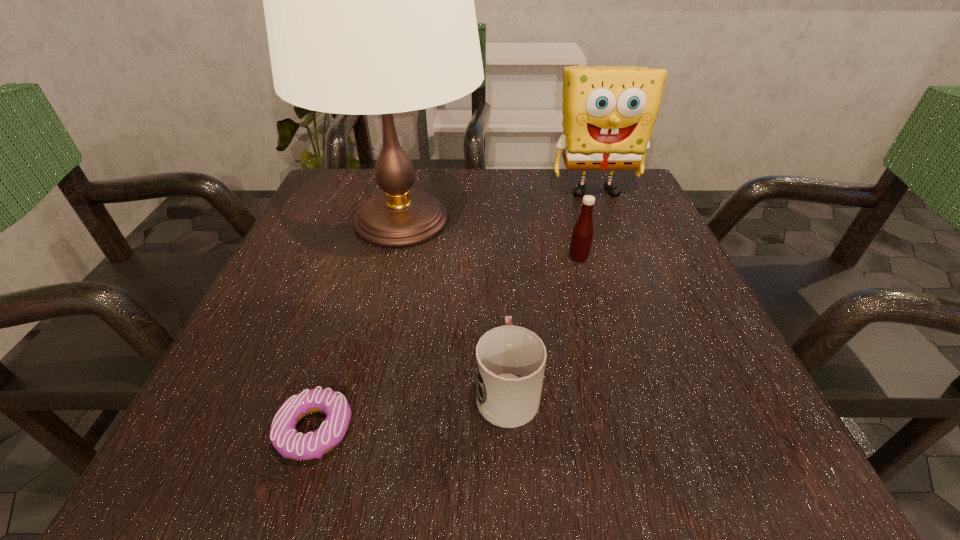
I want to click on object that is at the near left corner, so click(285, 438).

This screenshot has height=540, width=960. In order to click on object that is at the far right corner in this screenshot , I will do `click(609, 112)`.

This screenshot has width=960, height=540. In order to click on free location at the far edge of the desktop in this screenshot , I will do `click(517, 215)`.

You are a GUI agent. You are given a task and a screenshot of the screen. Output one action in this format:
    pyautogui.click(x=<x>, y=<y>)
    Task: Click on the vacant space at the near edge of the desktop
    The height and width of the screenshot is (540, 960).
    Given the screenshot: What is the action you would take?
    pyautogui.click(x=445, y=446)

At what (x,y) coordinates should I click in order to perform the action: click on vacant space at the left edge. Please return your answer as a coordinate pair (x, y). Looking at the image, I should click on (322, 338).

The height and width of the screenshot is (540, 960). In the image, there is a desktop. What are the coordinates of `free space at the right edge` in the screenshot? It's located at (670, 364).

Locate an element on the screen. This screenshot has height=540, width=960. vacant space at the far left corner of the desktop is located at coordinates (354, 177).

Where is `empty space between the fourth shortest object and the lamp`? The height and width of the screenshot is (540, 960). empty space between the fourth shortest object and the lamp is located at coordinates (498, 205).

This screenshot has height=540, width=960. Find the location of `vacant area that lies between the third tallest object and the lamp`. vacant area that lies between the third tallest object and the lamp is located at coordinates (490, 239).

Image resolution: width=960 pixels, height=540 pixels. Find the location of `free area in between the sponge and the doughnut`. free area in between the sponge and the doughnut is located at coordinates (455, 310).